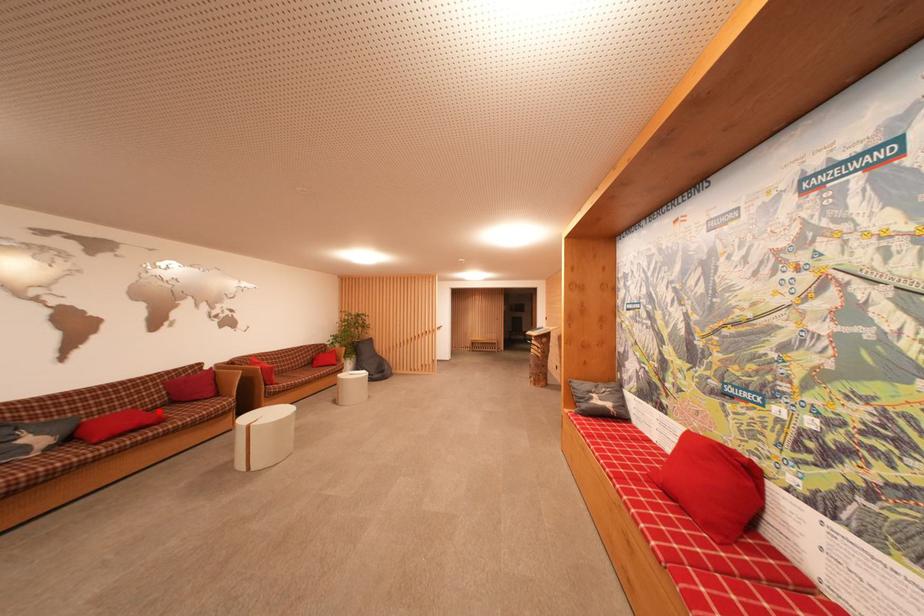
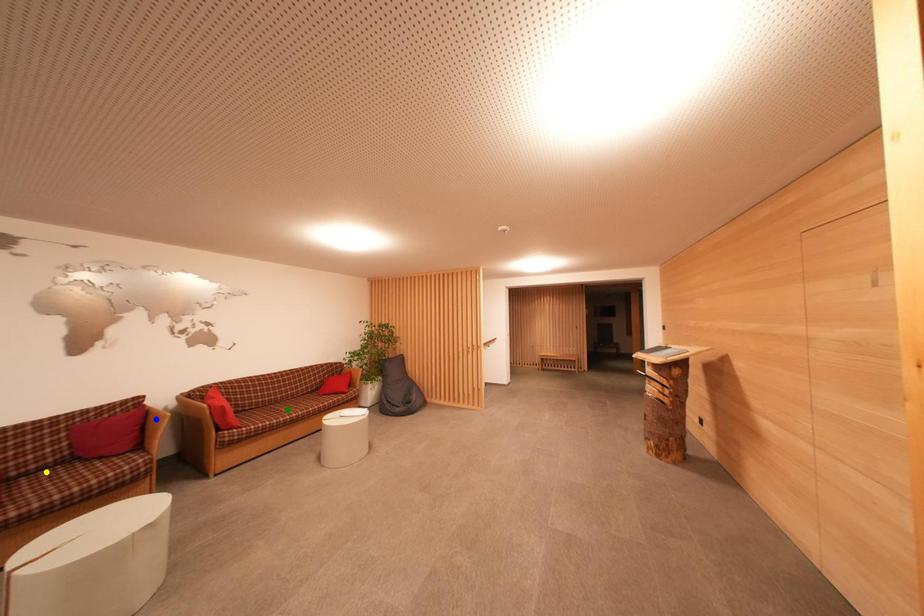
Question: I am providing you with two images of the same scene from different viewpoints. A red point is marked on the first image. You are given multiple points on the second image. Which mark in image 2 goes with the point in image 1?

Choices:
 (A) green point
 (B) yellow point
 (C) blue point

Answer: (B)